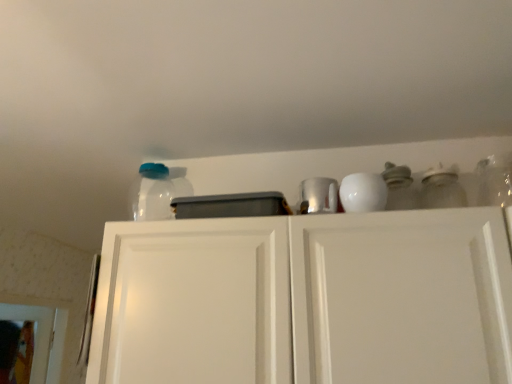
Question: Considering the relative sizes of clear glass jar at upper right, which ranks as the second glass jar in left-to-right order, and white matte cabinet doors at upper center in the image provided, is clear glass jar at upper right, which ranks as the second glass jar in left-to-right order, thinner than white matte cabinet doors at upper center?

Choices:
 (A) no
 (B) yes

Answer: (B)

Question: Could you tell me if clear glass jar at upper right, which ranks as the second glass jar in left-to-right order, is turned towards white matte cabinet doors at upper center?

Choices:
 (A) no
 (B) yes

Answer: (A)

Question: Is clear glass jar at upper right, the second glass jar in the back-to-front sequence, to the left of white matte cabinet doors at upper center from the viewer's perspective?

Choices:
 (A) no
 (B) yes

Answer: (A)

Question: From a real-world perspective, is clear glass jar at upper right, which ranks as the first glass jar in front-to-back order, under white matte cabinet doors at upper center?

Choices:
 (A) no
 (B) yes

Answer: (A)

Question: Considering the relative positions of clear glass jar at upper right, positioned as the 1th glass jar in right-to-left order, and white matte cabinet doors at upper center in the image provided, is clear glass jar at upper right, positioned as the 1th glass jar in right-to-left order, to the right of white matte cabinet doors at upper center from the viewer's perspective?

Choices:
 (A) no
 (B) yes

Answer: (B)

Question: Based on their sizes in the image, would you say clear glass jar at upper right, positioned as the 1th glass jar in right-to-left order, is bigger or smaller than white matte cabinet doors at upper center?

Choices:
 (A) big
 (B) small

Answer: (B)

Question: From the image's perspective, relative to white matte cabinet doors at upper center, is clear glass jar at upper right, the second glass jar in the back-to-front sequence, above or below?

Choices:
 (A) above
 (B) below

Answer: (A)

Question: In terms of width, does clear glass jar at upper right, which ranks as the second glass jar in left-to-right order, look wider or thinner when compared to white matte cabinet doors at upper center?

Choices:
 (A) thin
 (B) wide

Answer: (A)

Question: Considering the positions of clear glass jar at upper right, which ranks as the second glass jar in left-to-right order, and white matte cabinet doors at upper center in the image, is clear glass jar at upper right, which ranks as the second glass jar in left-to-right order, taller or shorter than white matte cabinet doors at upper center?

Choices:
 (A) short
 (B) tall

Answer: (A)

Question: From a real-world perspective, is shiny metallic cup at upper center positioned above or below clear glass jar at upper right, which ranks as the second glass jar in left-to-right order?

Choices:
 (A) above
 (B) below

Answer: (B)

Question: Visually, is shiny metallic cup at upper center positioned to the left or to the right of clear glass jar at upper right, which ranks as the first glass jar in front-to-back order?

Choices:
 (A) right
 (B) left

Answer: (B)

Question: Relative to clear glass jar at upper right, positioned as the 1th glass jar in right-to-left order, is shiny metallic cup at upper center in front or behind?

Choices:
 (A) front
 (B) behind

Answer: (B)

Question: Considering the positions of shiny metallic cup at upper center and clear glass jar at upper right, which ranks as the second glass jar in left-to-right order, in the image, is shiny metallic cup at upper center taller or shorter than clear glass jar at upper right, which ranks as the second glass jar in left-to-right order,?

Choices:
 (A) tall
 (B) short

Answer: (B)

Question: In terms of size, does shiny metallic cup at upper center appear bigger or smaller than white matte cabinet doors at upper center?

Choices:
 (A) small
 (B) big

Answer: (A)

Question: Considering the positions of shiny metallic cup at upper center and white matte cabinet doors at upper center in the image, is shiny metallic cup at upper center taller or shorter than white matte cabinet doors at upper center?

Choices:
 (A) tall
 (B) short

Answer: (B)